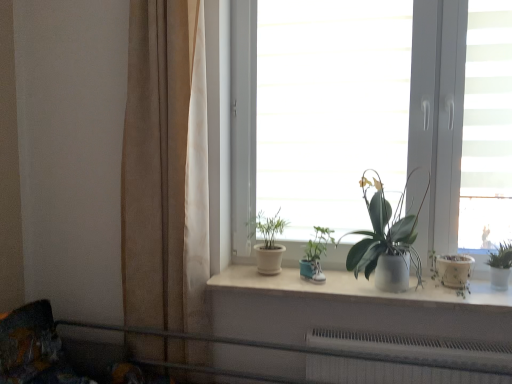
Where is `vacant area that is in front of teal fabric shoe at center, which is the 3th houseplant in right-to-left order`? vacant area that is in front of teal fabric shoe at center, which is the 3th houseplant in right-to-left order is located at coordinates (326, 289).